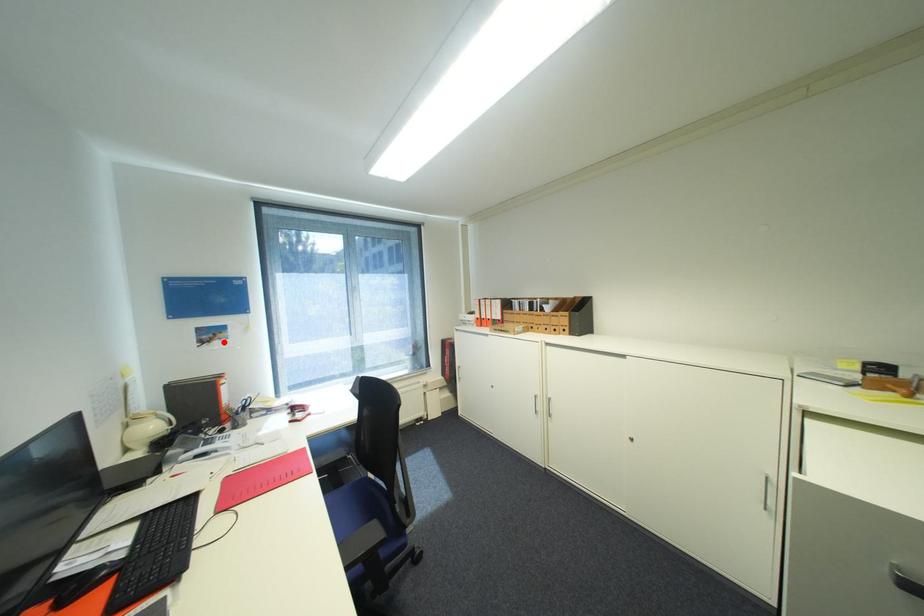
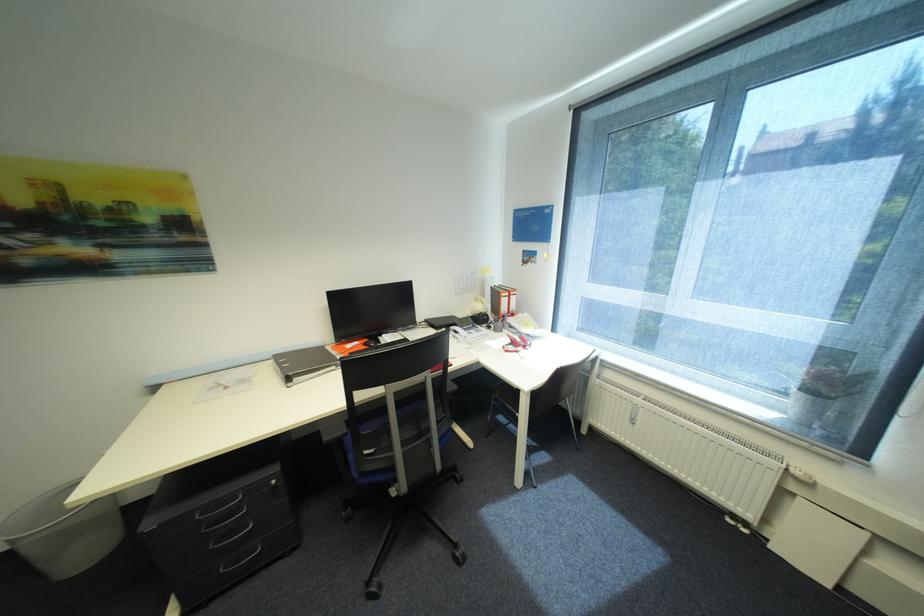
Where in the second image is the point corresponding to the highlighted location from the first image?

(537, 265)